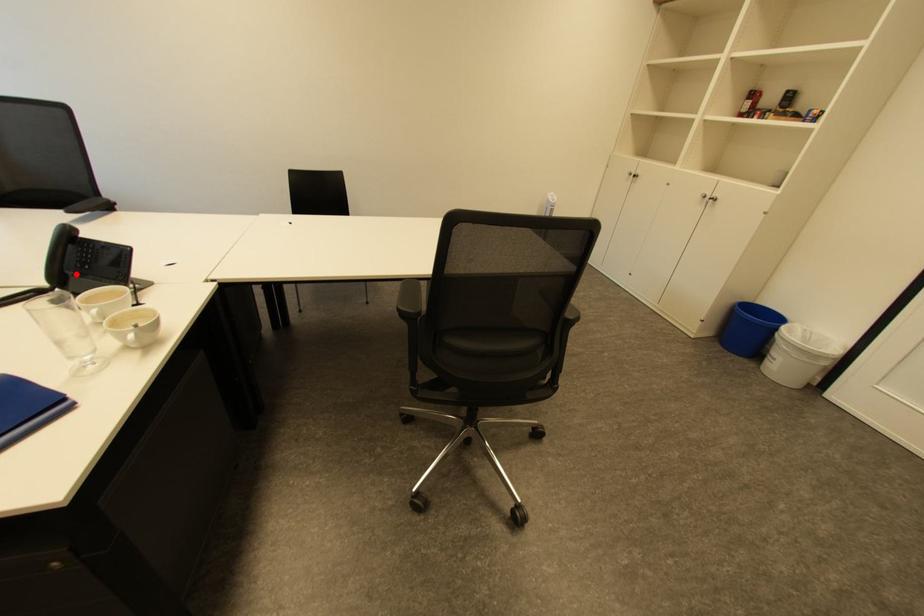
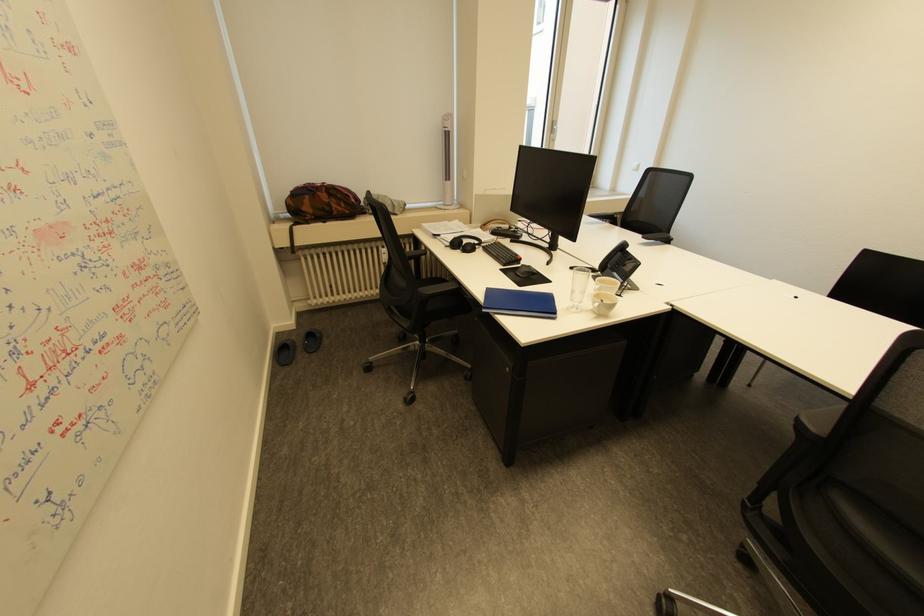
Where in the second image is the point corresponding to the highlighted location from the first image?

(616, 267)